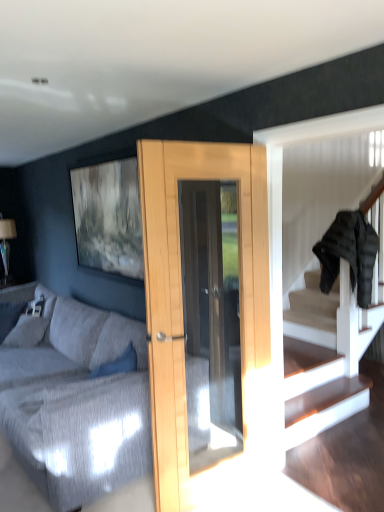
Question: Considering the positions of textured gray fabric couch at center and black puffer jacket at upper right in the image, is textured gray fabric couch at center bigger or smaller than black puffer jacket at upper right?

Choices:
 (A) big
 (B) small

Answer: (A)

Question: From a real-world perspective, is textured gray fabric couch at center above or below black puffer jacket at upper right?

Choices:
 (A) below
 (B) above

Answer: (A)

Question: Does point (102, 327) appear closer or farther from the camera than point (340, 224)?

Choices:
 (A) closer
 (B) farther

Answer: (B)

Question: In the image, is black puffer jacket at upper right positioned in front of or behind textured gray fabric couch at center?

Choices:
 (A) front
 (B) behind

Answer: (B)

Question: Is black puffer jacket at upper right wider or thinner than textured gray fabric couch at center?

Choices:
 (A) wide
 (B) thin

Answer: (B)

Question: Does point (322, 268) appear closer or farther from the camera than point (3, 395)?

Choices:
 (A) closer
 (B) farther

Answer: (B)

Question: Would you say black puffer jacket at upper right is to the left or to the right of textured gray fabric couch at center in the picture?

Choices:
 (A) left
 (B) right

Answer: (B)